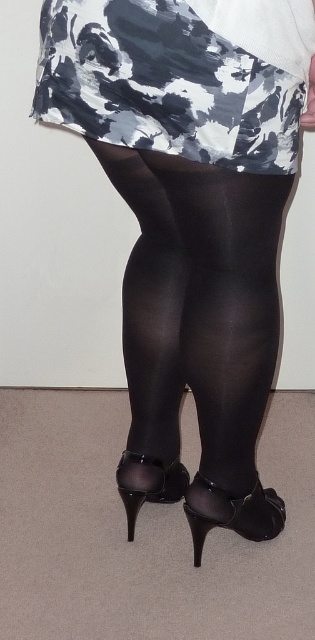
Question: Is white and gray abstract fabric at upper center smaller than black sheer tights at center?

Choices:
 (A) yes
 (B) no

Answer: (A)

Question: Which object is positioned farthest from the black glossy tights at center?

Choices:
 (A) white and gray abstract fabric at upper center
 (B) black sheer tights at center
 (C) black satin stocking at lower center

Answer: (C)

Question: Estimate the real-world distances between objects in this image. Which object is closer to the white and gray abstract fabric at upper center?

Choices:
 (A) black satin stocking at lower center
 (B) black sheer tights at center
 (C) black glossy tights at center

Answer: (B)

Question: Does white and gray abstract fabric at upper center appear over black satin stocking at lower center?

Choices:
 (A) yes
 (B) no

Answer: (A)

Question: Based on their relative distances, which object is farther from the black satin stocking at lower center?

Choices:
 (A) white and gray abstract fabric at upper center
 (B) black glossy tights at center

Answer: (A)

Question: Can you confirm if white and gray abstract fabric at upper center is smaller than black sheer tights at center?

Choices:
 (A) no
 (B) yes

Answer: (B)